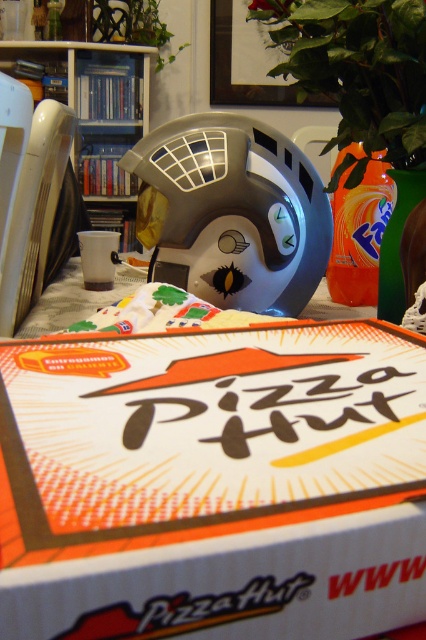
Does matte plastic helmet at center have a greater width compared to green leafy plant at upper right?

Correct, the width of matte plastic helmet at center exceeds that of green leafy plant at upper right.

Does matte plastic helmet at center have a larger size compared to green leafy plant at upper right?

No, matte plastic helmet at center is not bigger than green leafy plant at upper right.

At what (x,y) coordinates should I click in order to perform the action: click on matte plastic helmet at center. Please return your answer as a coordinate pair (x, y). This screenshot has height=640, width=426. Looking at the image, I should click on (232, 212).

This screenshot has width=426, height=640. What do you see at coordinates (213, 483) in the screenshot? I see `white cardboard pizza hut box at center` at bounding box center [213, 483].

Does white cardboard pizza hut box at center have a larger size compared to green leafy plant at upper center?

Actually, white cardboard pizza hut box at center might be smaller than green leafy plant at upper center.

Where is `white cardboard pizza hut box at center`? This screenshot has width=426, height=640. white cardboard pizza hut box at center is located at coordinates (213, 483).

Identify the location of white cardboard pizza hut box at center. This screenshot has width=426, height=640. (213, 483).

Which is more to the left, green leafy plant at upper right or green leafy plant at upper center?

Positioned to the left is green leafy plant at upper center.

Can you confirm if green leafy plant at upper right is bigger than green leafy plant at upper center?

Actually, green leafy plant at upper right might be smaller than green leafy plant at upper center.

Is point (296, 74) positioned behind point (97, 38)?

No, (296, 74) is closer to viewer.

You are a GUI agent. You are given a task and a screenshot of the screen. Output one action in this format:
    pyautogui.click(x=<x>, y=<y>)
    Task: Click on the green leafy plant at upper right
    The image size is (426, 640).
    Given the screenshot: What is the action you would take?
    pyautogui.click(x=357, y=72)